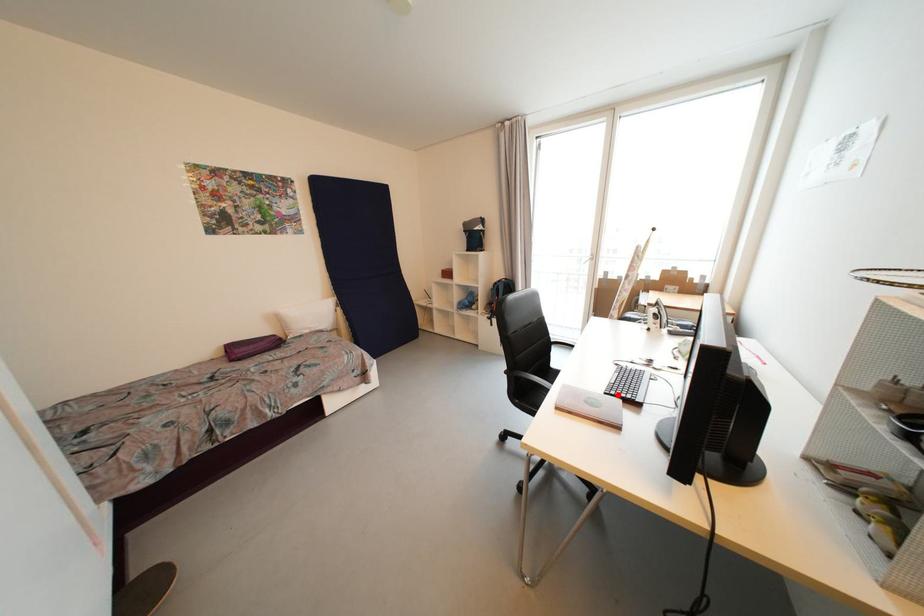
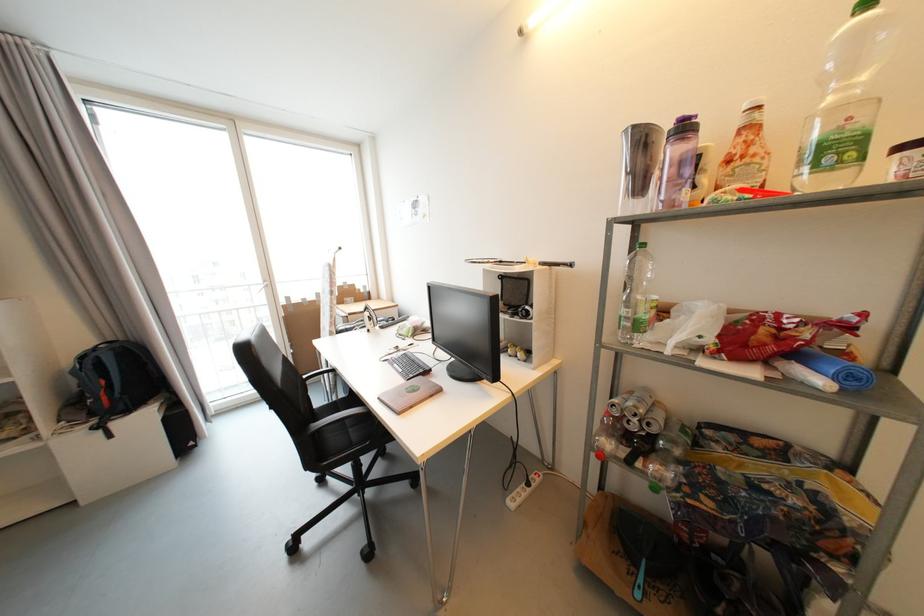
Where in the second image is the point corresponding to the highlighted location from the first image?

(417, 378)